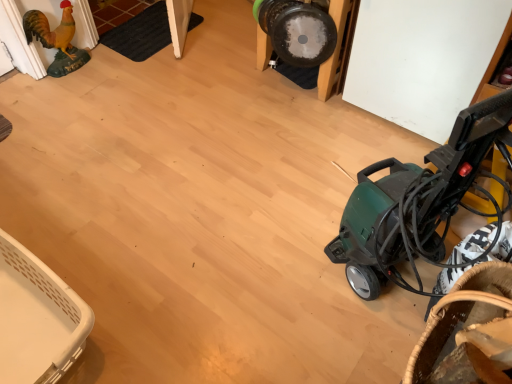
Identify the location of free space in front of green plastic vacuum cleaner at right. (354, 349).